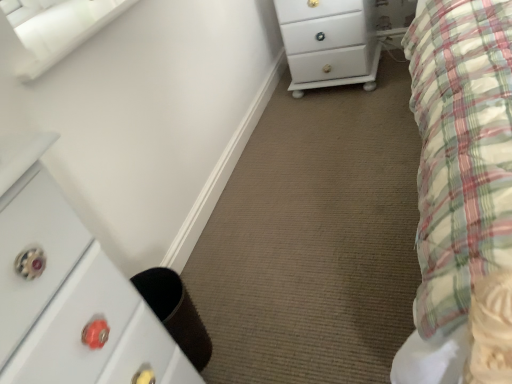
What do you see at coordinates (329, 42) in the screenshot?
I see `white glossy chest of drawers at upper right` at bounding box center [329, 42].

Identify the location of white glossy chest of drawers at upper right. (329, 42).

In order to face white glossy chest of drawers at upper right, should I rotate leftwards or rightwards?

To align with it, rotate right about 10.096°.

Image resolution: width=512 pixels, height=384 pixels. What are the coordinates of `white glossy chest of drawers at upper right` in the screenshot? It's located at (329, 42).